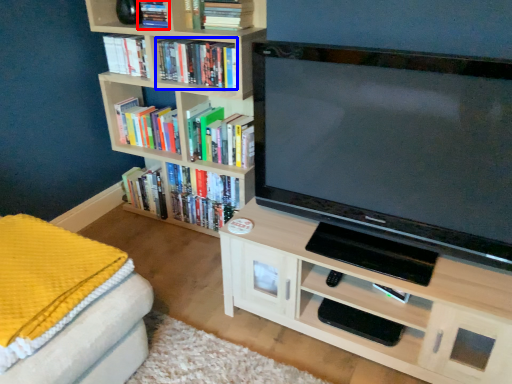
Question: Which point is closer to the camera, book (highlighted by a red box) or book (highlighted by a blue box)?

Choices:
 (A) book
 (B) book

Answer: (B)